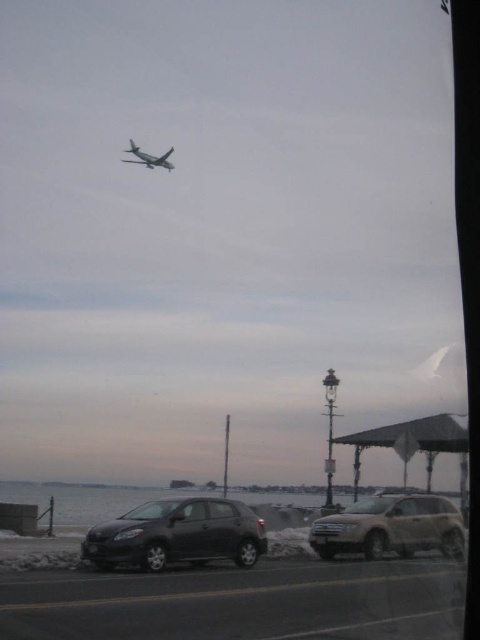
Who is more distant from viewer, (348,552) or (147,160)?

The point (147,160) is behind.

Describe the element at coordinates (391, 525) in the screenshot. I see `beige matte suv at lower right` at that location.

Find the location of a particular element. Image resolution: width=480 pixels, height=640 pixels. beige matte suv at lower right is located at coordinates [391, 525].

Is matte black car at lower center taller than silver metallic airplane at upper center?

No, matte black car at lower center is not taller than silver metallic airplane at upper center.

Does matte black car at lower center appear over silver metallic airplane at upper center?

No.

Is point (158, 538) positioned behind point (152, 161)?

That is False.

At what (x,y) coordinates should I click in order to perform the action: click on matte black car at lower center. Please return your answer as a coordinate pair (x, y). The image size is (480, 640). Looking at the image, I should click on coord(178,534).

Is matte black car at lower center shorter than beige matte suv at lower right?

Correct, matte black car at lower center is not as tall as beige matte suv at lower right.

Which is behind, point (130, 515) or point (322, 556)?

The point (322, 556) is more distant.

I want to click on matte black car at lower center, so click(x=178, y=534).